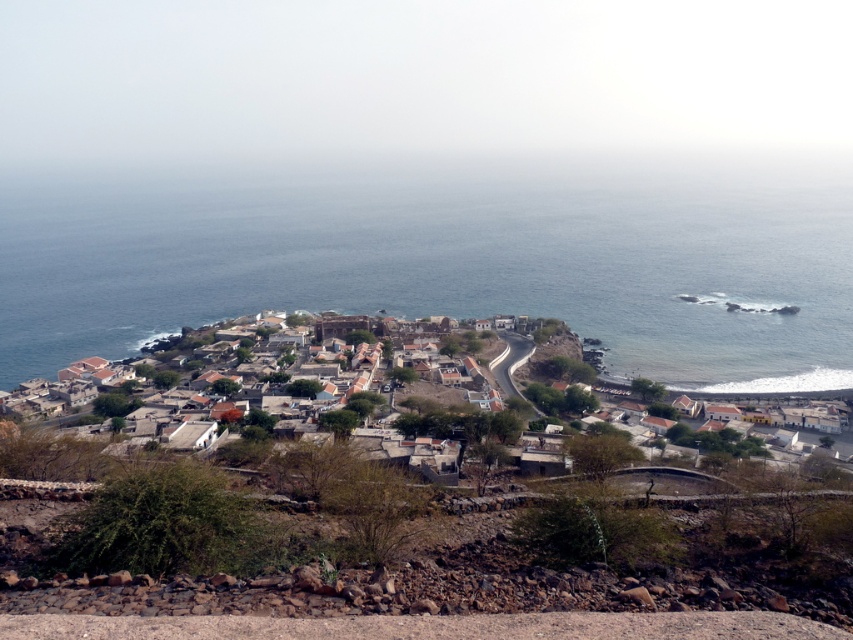
Question: Which point is farther from the camera taking this photo?

Choices:
 (A) (614, 320)
 (B) (721, 264)

Answer: (B)

Question: Which of the following is the closest to the observer?

Choices:
 (A) (808, 384)
 (B) (354, 189)

Answer: (A)

Question: Does blue water at center appear under brown clay houses at center?

Choices:
 (A) no
 (B) yes

Answer: (A)

Question: Is blue water at center to the right of brown clay houses at center from the viewer's perspective?

Choices:
 (A) yes
 (B) no

Answer: (B)

Question: Can you confirm if blue water at center is positioned above brown clay houses at center?

Choices:
 (A) yes
 (B) no

Answer: (A)